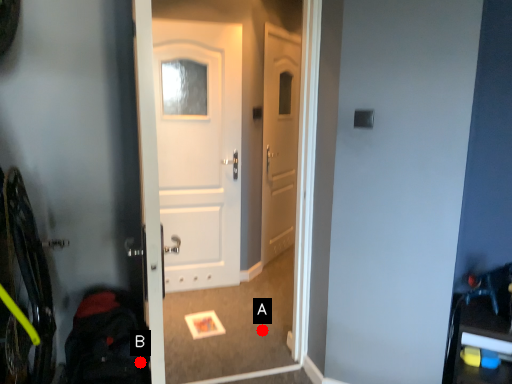
Question: Two points are circled on the image, labeled by A and B beside each circle. Among these points, which one is nearest to the camera?

Choices:
 (A) A is closer
 (B) B is closer

Answer: (B)